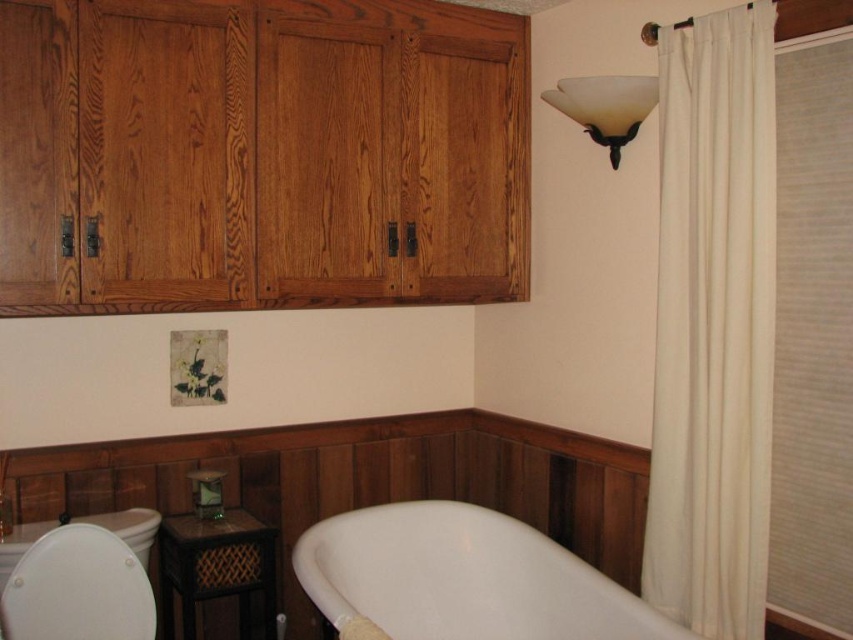
You are designing a bathroom layout and need to place a large plant pot. The white fabric shower curtain at right and the white frosted glass sconce at upper right are already in place. Which object should you avoid placing the plant pot near to ensure it doesn

The white fabric shower curtain at right is larger in size than the white frosted glass sconce at upper right, so placing the plant pot near the shower curtain might require more space. Avoid placing the plant pot near the white fabric shower curtain at right to ensure it doesn

You are standing in the bathroom and want to determine which of the two points, point (531, 586) or point (647, 33), is closer to you. Based on the scene description, which point is nearer?

Point (531, 586) is further to the viewer than point (647, 33). Wait, the description says the opposite. Let me check again. The Objects Description states that point (531, 586) is further to the viewer than point (647, 33). Therefore, the closer point to you would be point (647, 33) since it is less further away.